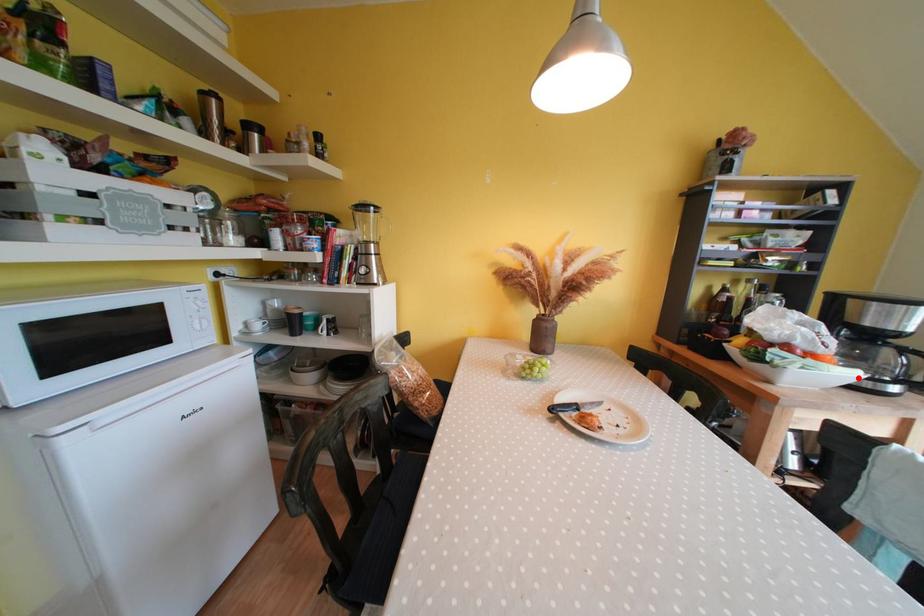
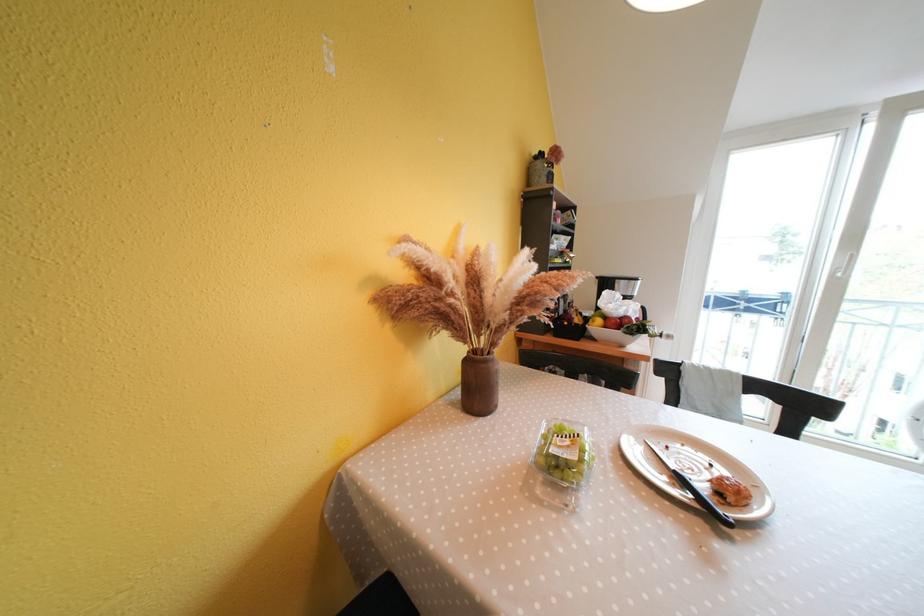
Question: I am providing you with two images of the same scene from different viewpoints. A red point is marked on the first image. Is the red point's position out of view in image 2?

Choices:
 (A) Yes
 (B) No

Answer: (A)